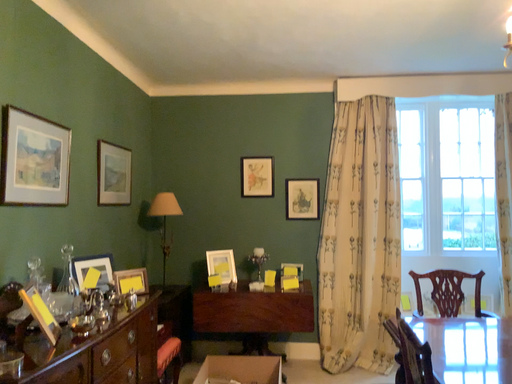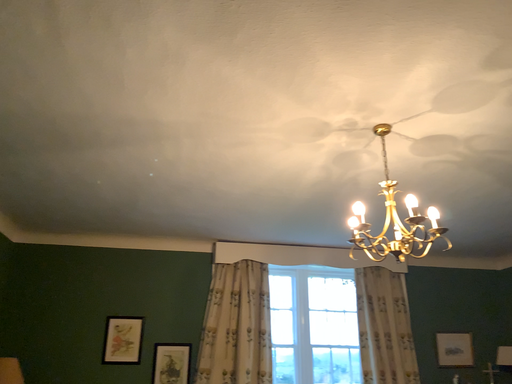
Question: How did the camera likely rotate when shooting the video?

Choices:
 (A) rotated right
 (B) rotated left

Answer: (A)